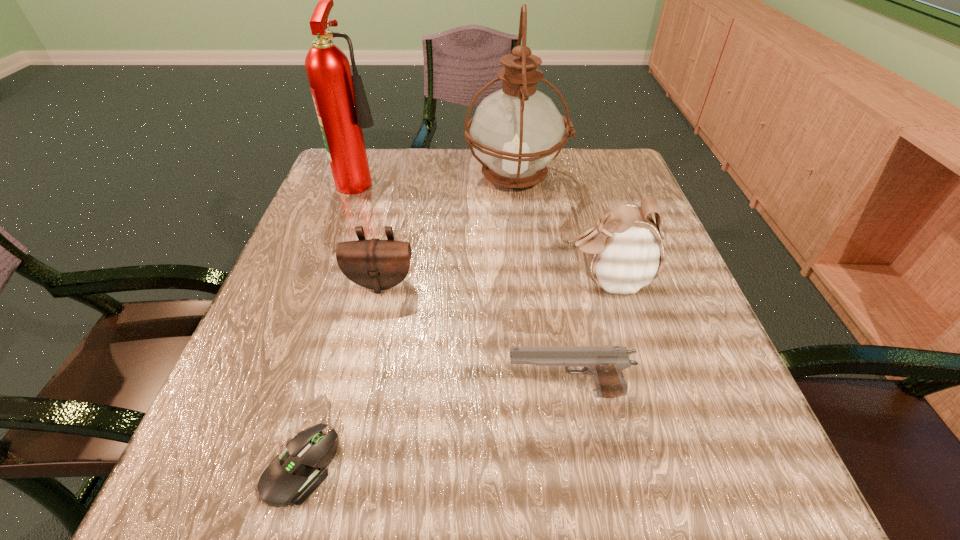
Locate an element on the screen. This screenshot has height=540, width=960. vacant space at the far edge is located at coordinates (556, 188).

Find the location of `free space at the left edge`. free space at the left edge is located at coordinates (340, 386).

The width and height of the screenshot is (960, 540). What are the coordinates of `vacant space at the right edge of the desktop` in the screenshot? It's located at (682, 396).

Locate an element on the screen. This screenshot has height=540, width=960. free space at the near left corner of the desktop is located at coordinates (242, 477).

The image size is (960, 540). What are the coordinates of `vacant space at the near right corner of the desktop` in the screenshot? It's located at (739, 502).

The width and height of the screenshot is (960, 540). In order to click on free spot between the oil lamp and the nearest object in this screenshot , I will do `click(408, 322)`.

What are the coordinates of `blank region between the second nearest object and the oil lamp` in the screenshot? It's located at (541, 285).

The image size is (960, 540). In order to click on free point between the fire extinguisher and the taller pouch in this screenshot , I will do `click(485, 230)`.

Locate an element on the screen. The image size is (960, 540). unoccupied position between the computer mouse and the fire extinguisher is located at coordinates (331, 323).

In order to click on empty space between the fifth farthest object and the oil lamp in this screenshot , I will do `click(541, 285)`.